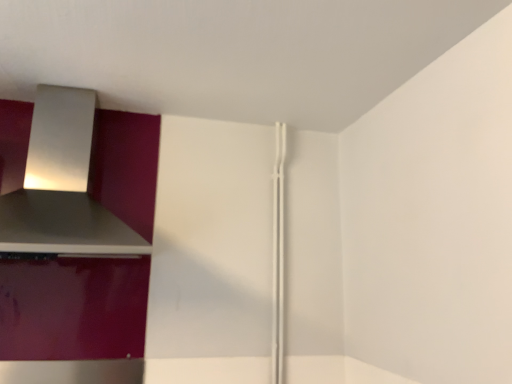
This screenshot has width=512, height=384. What do you see at coordinates (62, 186) in the screenshot? I see `satin silver vent at upper left` at bounding box center [62, 186].

Where is `satin silver vent at upper left`? This screenshot has width=512, height=384. satin silver vent at upper left is located at coordinates (62, 186).

Locate an element on the screen. satin silver vent at upper left is located at coordinates (62, 186).